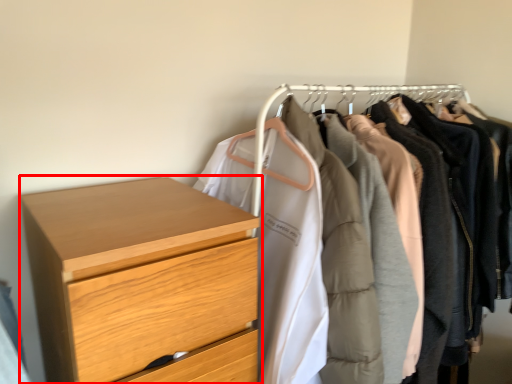
Question: Observing the image, what is the correct spatial positioning of chest of drawers (annotated by the red box) in reference to closet?

Choices:
 (A) left
 (B) right

Answer: (A)